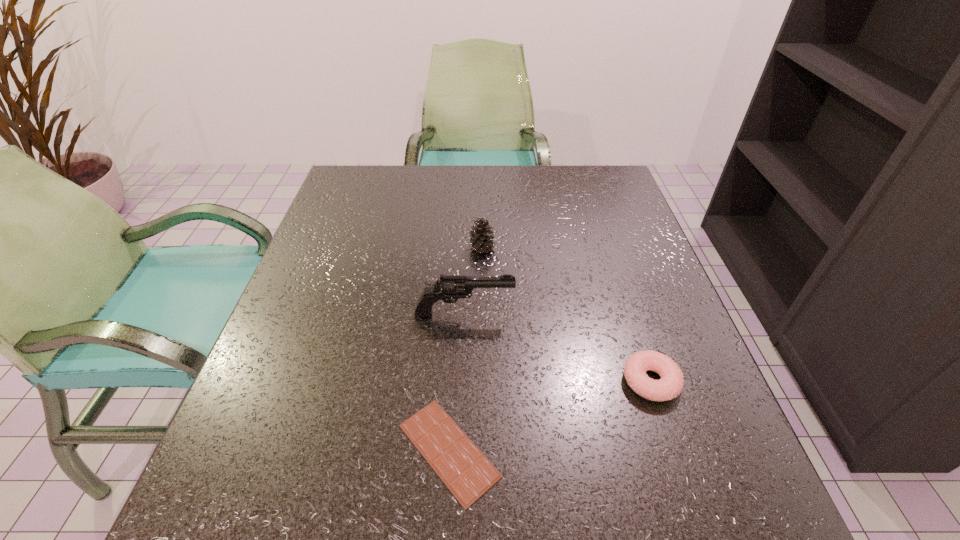
Locate an element on the screen. free point between the rightmost object and the third shortest object is located at coordinates (566, 314).

Find the location of a particular element. vacant area that lies between the chocolate bar and the second tallest object is located at coordinates (466, 349).

Image resolution: width=960 pixels, height=540 pixels. I want to click on free space between the doughnut and the tallest object, so click(x=557, y=348).

The height and width of the screenshot is (540, 960). What are the coordinates of `unoccupied position between the chocolate bar and the tallest object` in the screenshot? It's located at [456, 382].

Locate an element on the screen. The width and height of the screenshot is (960, 540). vacant region between the gun and the shortest object is located at coordinates (456, 382).

The height and width of the screenshot is (540, 960). Identify the location of blank region between the shortest object and the third tallest object. (550, 416).

The height and width of the screenshot is (540, 960). What are the coordinates of `empty space that is in between the gun and the shortest object` in the screenshot? It's located at (456, 382).

Where is `object identified as the closest to the pinecone`? This screenshot has width=960, height=540. object identified as the closest to the pinecone is located at coordinates (450, 288).

Locate which object ranks third in proximity to the chocolate bar. Please provide its 2D coordinates. Your answer should be formatted as a tuple, i.e. [(x, y)], where the tuple contains the x and y coordinates of a point satisfying the conditions above.

[(481, 238)]

Where is `vacant space that satisfies the following two spatial constraints: 1. at the end of the barrel of the tallest object; 2. on the back side of the rightmost object`? This screenshot has height=540, width=960. vacant space that satisfies the following two spatial constraints: 1. at the end of the barrel of the tallest object; 2. on the back side of the rightmost object is located at coordinates (462, 381).